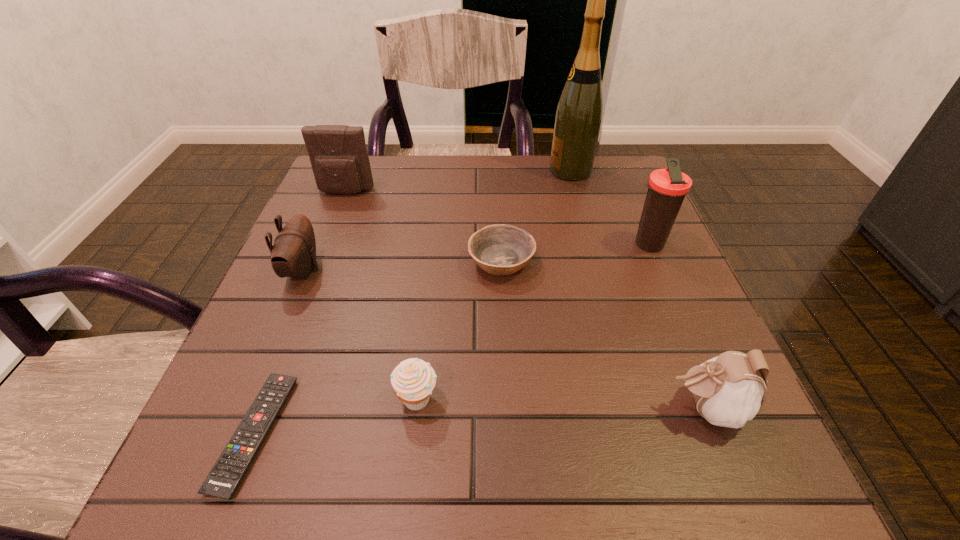
You are a GUI agent. You are given a task and a screenshot of the screen. Output one action in this format:
    pyautogui.click(x=<x>, y=<y>)
    Task: Click on the free space between the tallest object and the second farthest object
    
    Given the screenshot: What is the action you would take?
    pyautogui.click(x=458, y=181)

This screenshot has height=540, width=960. I want to click on object that ranks as the fourth closest to the second tallest object, so click(x=413, y=380).

Identify which object is located as the seventh nearest to the sixth shortest object. Please provide its 2D coordinates. Your answer should be formatted as a tuple, i.e. [(x, y)], where the tuple contains the x and y coordinates of a point satisfying the conditions above.

[(729, 389)]

The image size is (960, 540). I want to click on the second closest pouch relative to the seventh shortest object, so click(338, 155).

Locate an element on the screen. Image resolution: width=960 pixels, height=540 pixels. the third closest pouch to the shortest object is located at coordinates (729, 389).

You are a GUI agent. You are given a task and a screenshot of the screen. Output one action in this format:
    pyautogui.click(x=<x>, y=<y>)
    Task: Click on the free location that satisfies the following two spatial constraints: 1. on the front-facing side of the farthest object; 2. on the left side of the seventh shortest object
    The height and width of the screenshot is (540, 960).
    Given the screenshot: What is the action you would take?
    pyautogui.click(x=591, y=244)

Identify the location of free spot that satisfies the following two spatial constraints: 1. with the flap open on the second farthest pouch; 2. on the left side of the muffin. The image size is (960, 540). (249, 399).

This screenshot has height=540, width=960. Find the location of `vacant space that satisfies the following two spatial constraints: 1. with an open flap on the second farthest object; 2. on the left side of the muffin`. vacant space that satisfies the following two spatial constraints: 1. with an open flap on the second farthest object; 2. on the left side of the muffin is located at coordinates (264, 399).

The height and width of the screenshot is (540, 960). What are the coordinates of `free point that satisfies the following two spatial constraints: 1. with an open flap on the bowl; 2. on the left side of the second farthest object` in the screenshot? It's located at (318, 261).

Locate an element on the screen. The image size is (960, 540). blank area in the image that satisfies the following two spatial constraints: 1. on the back side of the remote control; 2. with the flap open on the second nearest pouch is located at coordinates (318, 270).